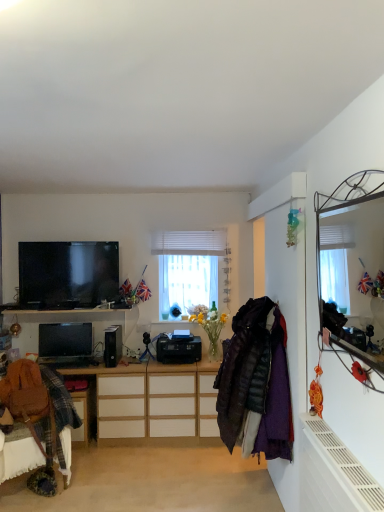
Question: From a real-world perspective, does white matte radiator at lower right sit lower than black plastic desktop computer at center?

Choices:
 (A) no
 (B) yes

Answer: (B)

Question: Does white matte radiator at lower right have a larger size compared to black plastic desktop computer at center?

Choices:
 (A) no
 (B) yes

Answer: (B)

Question: Does white matte radiator at lower right appear on the left side of black plastic desktop computer at center?

Choices:
 (A) no
 (B) yes

Answer: (A)

Question: Is white matte radiator at lower right wider than black plastic desktop computer at center?

Choices:
 (A) yes
 (B) no

Answer: (A)

Question: Does white matte radiator at lower right have a greater height compared to black plastic desktop computer at center?

Choices:
 (A) no
 (B) yes

Answer: (B)

Question: Is white matte radiator at lower right not within black plastic desktop computer at center?

Choices:
 (A) no
 (B) yes

Answer: (B)

Question: From the image's perspective, is wooden cabinet at center located beneath black plastic desktop computer at center?

Choices:
 (A) yes
 (B) no

Answer: (B)

Question: Does wooden cabinet at center have a smaller size compared to black plastic desktop computer at center?

Choices:
 (A) yes
 (B) no

Answer: (B)

Question: Does wooden cabinet at center have a greater height compared to black plastic desktop computer at center?

Choices:
 (A) yes
 (B) no

Answer: (B)

Question: Is wooden cabinet at center far from black plastic desktop computer at center?

Choices:
 (A) yes
 (B) no

Answer: (B)

Question: Is the position of wooden cabinet at center less distant than that of black plastic desktop computer at center?

Choices:
 (A) no
 (B) yes

Answer: (B)

Question: Is wooden cabinet at center located outside black plastic desktop computer at center?

Choices:
 (A) yes
 (B) no

Answer: (A)

Question: Is black plastic speaker at center positioned far away from white textured blinds at center?

Choices:
 (A) yes
 (B) no

Answer: (B)